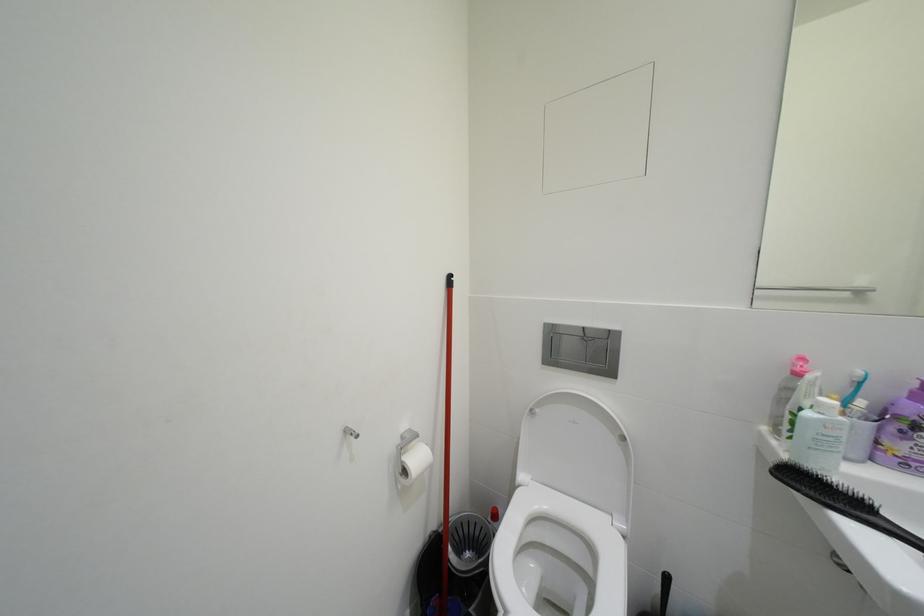
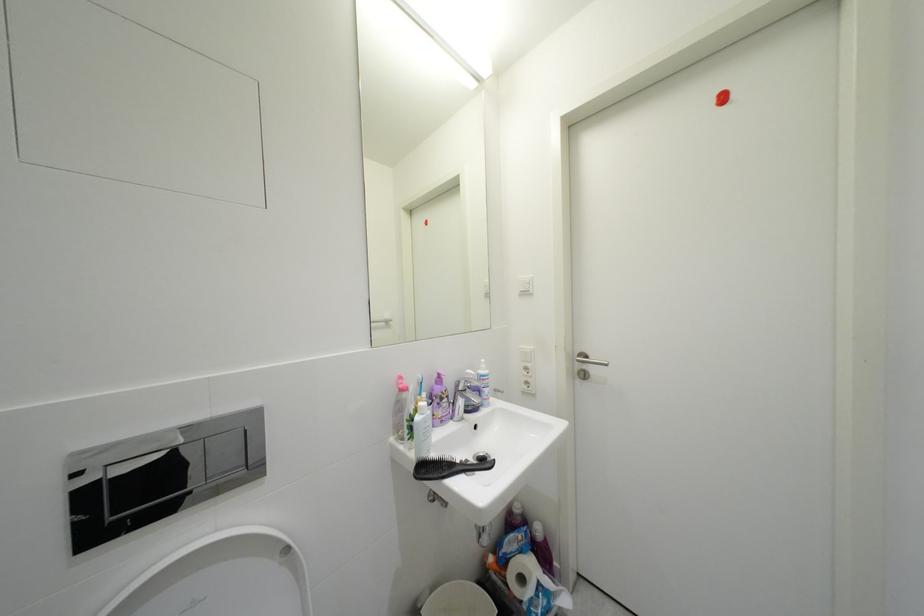
Question: The images are taken continuously from a first-person perspective. In which direction is your viewpoint rotating?

Choices:
 (A) Left
 (B) Right
 (C) Up
 (D) Down

Answer: (B)